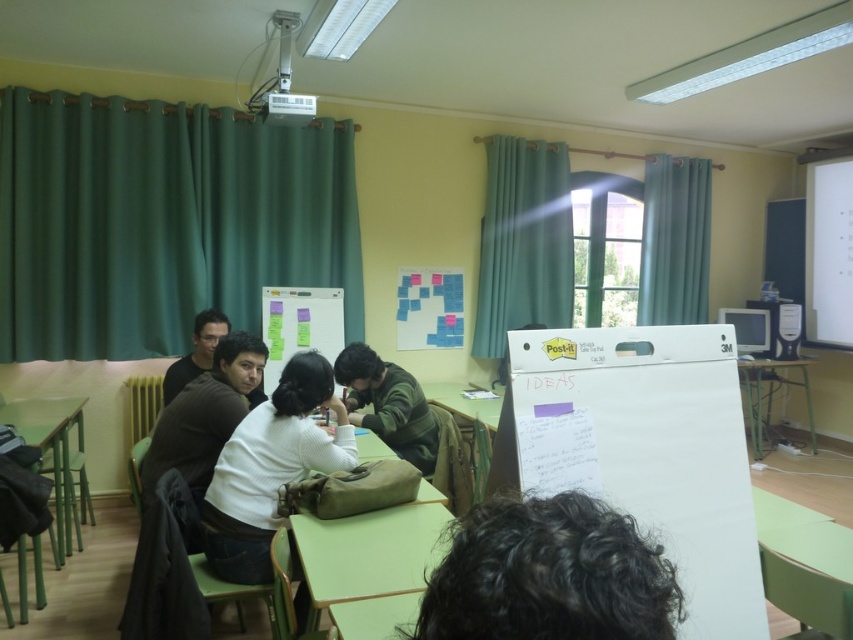
Can you confirm if green matte table at center is positioned below green plastic table at lower left?

Incorrect, green matte table at center is not positioned below green plastic table at lower left.

Does green matte table at center have a lesser height compared to green plastic table at lower left?

Yes.

Where is `green matte table at center`? green matte table at center is located at coordinates (370, 552).

Based on the photo, who is positioned more to the left, teal fabric curtain at upper right or green striped sweater at center?

green striped sweater at center

Does point (701, 189) come behind point (407, 416)?

Yes, it is.

Does point (668, 314) come farther from viewer compared to point (403, 406)?

That is True.

Identify the location of teal fabric curtain at upper right. (674, 241).

Is white matte sweater at center shorter than white matte shirt at center?

In fact, white matte sweater at center may be taller than white matte shirt at center.

Which is behind, point (263, 570) or point (186, 413)?

The point (186, 413) is behind.

This screenshot has width=853, height=640. I want to click on white matte sweater at center, so click(271, 467).